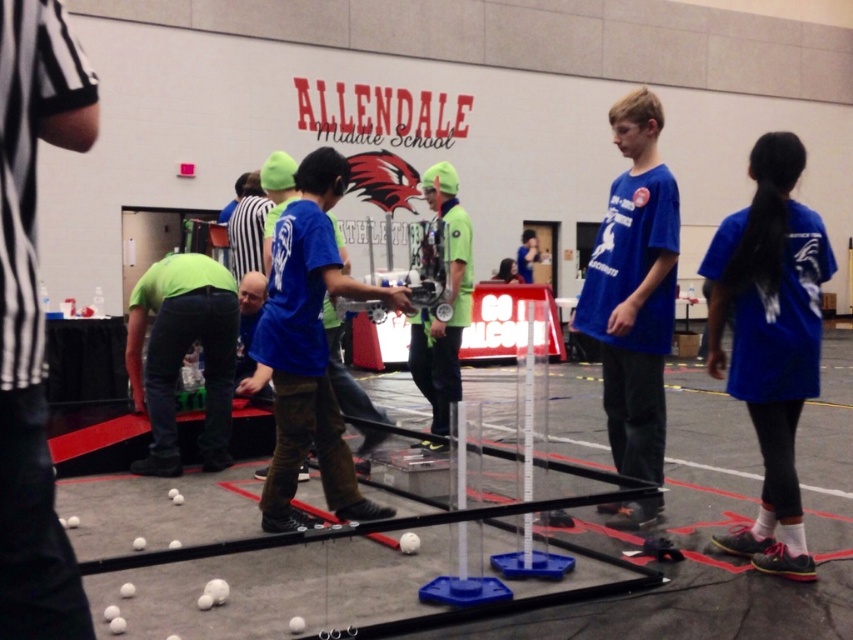
You are a participant in the robotics competition and need to determine the best position to stand so that you can clearly see both the blue matte shirt at center and the green fabric referee at center. Which object is narrower, allowing you to position yourself closer to it without blocking your view of the other?

The blue matte shirt at center has a lesser width compared to the green fabric referee at center, so you can position yourself closer to the blue matte shirt at center without blocking your view of the green fabric referee at center.

You are standing in the gymnasium and want to pick up an object. There are two points marked on the floor where objects are located. The first point is at coordinates point (312, 340) and the second is at point (125, 356). Which point is closer to you?

Point (312, 340) is closer to the viewer than point (125, 356), so you should go to point (312, 340) first.